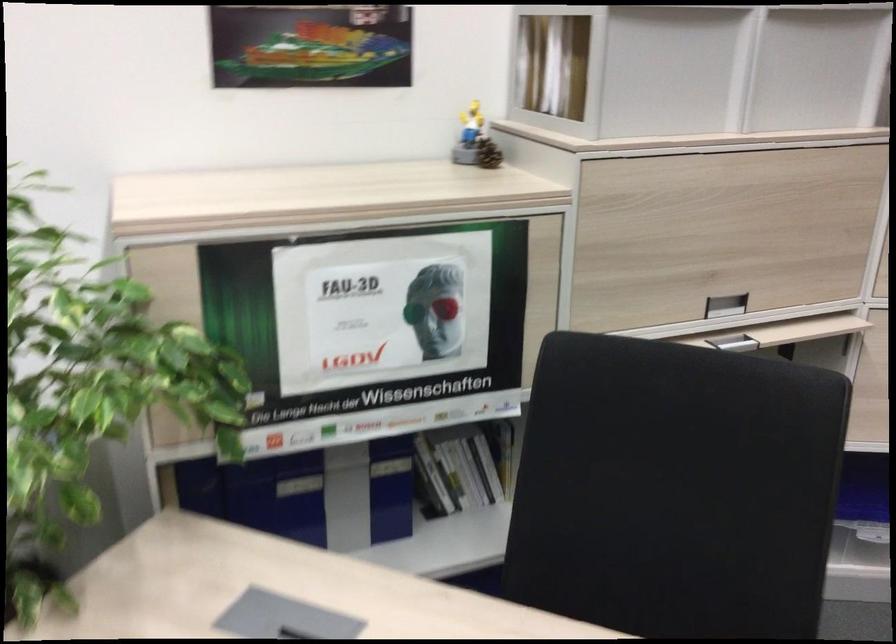
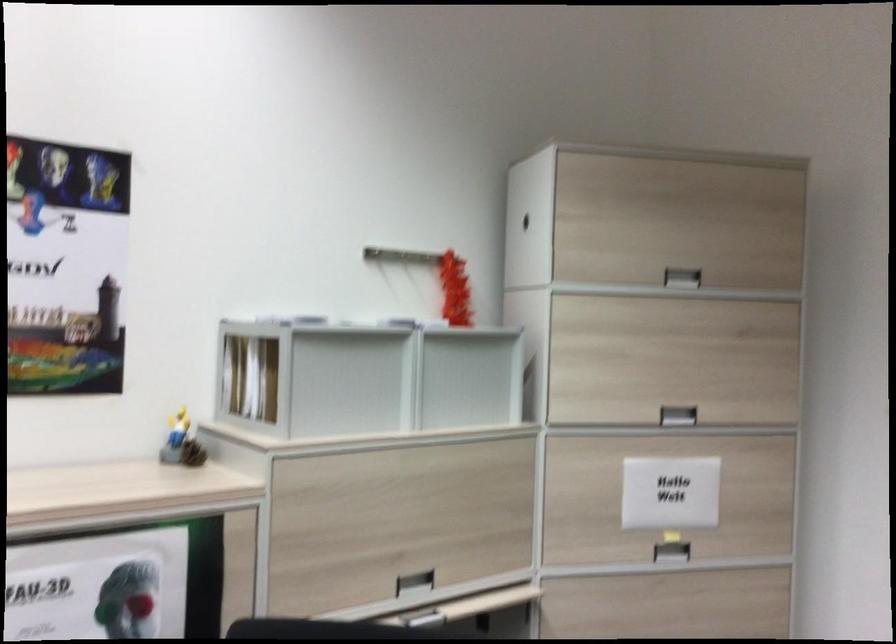
Locate, in the second image, the point that corresponds to (472,143) in the first image.

(181, 442)